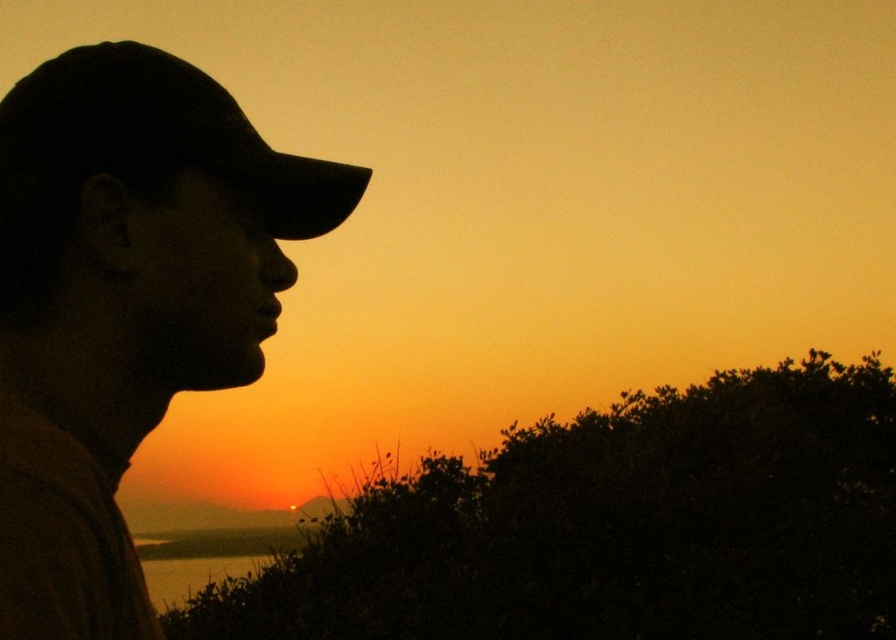
You are a photographer trying to capture the sunset scene. You notice the silhouette cap at left and the black matte baseball hat at left in your frame. Which of these two items is positioned lower in the image?

The silhouette cap at left is positioned below the black matte baseball hat at left, so the silhouette cap at left is lower in the image.

You are standing at the point marked by the coordinates point (125, 305) in the image. Looking towards the sunset, which direction should you face to see the silhouette cap at left?

The silhouette cap at left is represented by point (125, 305), so you are already at the location of the silhouette cap at left. To see it, you would need to look down or check your current position since you are standing right where it is marked.

You are an artist sketching the scene and want to ensure the proportions are accurate. Given that the silhouette cap at left and the black matte baseball hat at left are both on the left side of the frame, which one has a greater height in the drawing?

The silhouette cap at left is taller than the black matte baseball hat at left, so in the drawing, the silhouette cap at left should be depicted as taller.